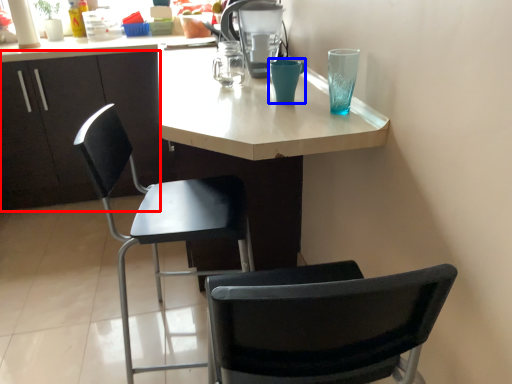
Question: Which point is closer to the camera, cabinetry (highlighted by a red box) or teal (highlighted by a blue box)?

Choices:
 (A) cabinetry
 (B) teal

Answer: (B)